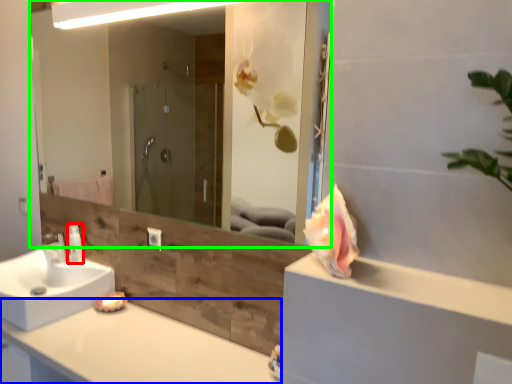
Question: Which is nearer to the toiletry (highlighted by a red box)? countertop (highlighted by a blue box) or mirror (highlighted by a green box).

Choices:
 (A) countertop
 (B) mirror

Answer: (A)